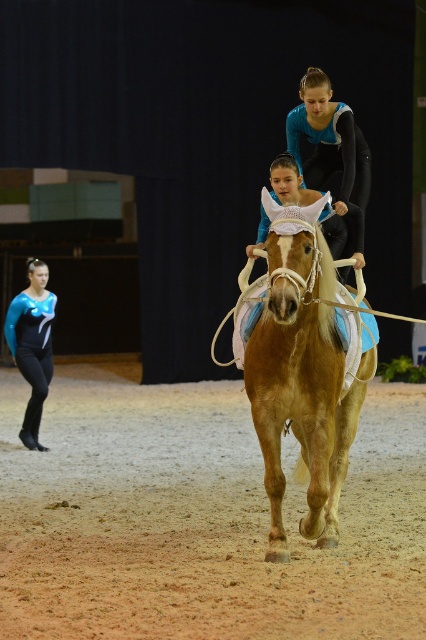
Question: Which of the following is the closest to the observer?

Choices:
 (A) (201, 460)
 (B) (14, 358)
 (C) (325, 108)

Answer: (C)

Question: Which object appears farthest from the camera in this image?

Choices:
 (A) matte blue leotard at lower left
 (B) blue matte uniform at center
 (C) light brown leather horse at center

Answer: (A)

Question: Does blue matte uniform at center appear on the right side of matte blue leotard at lower left?

Choices:
 (A) yes
 (B) no

Answer: (A)

Question: Is blue matte uniform at center smaller than matte blue leotard at lower left?

Choices:
 (A) no
 (B) yes

Answer: (A)

Question: Is brown sandy dirt track at lower center closer to camera compared to light brown leather horse at center?

Choices:
 (A) yes
 (B) no

Answer: (A)

Question: Which of the following is the closest to the observer?

Choices:
 (A) (55, 560)
 (B) (285, 364)
 (C) (29, 266)
 (D) (331, 90)

Answer: (B)